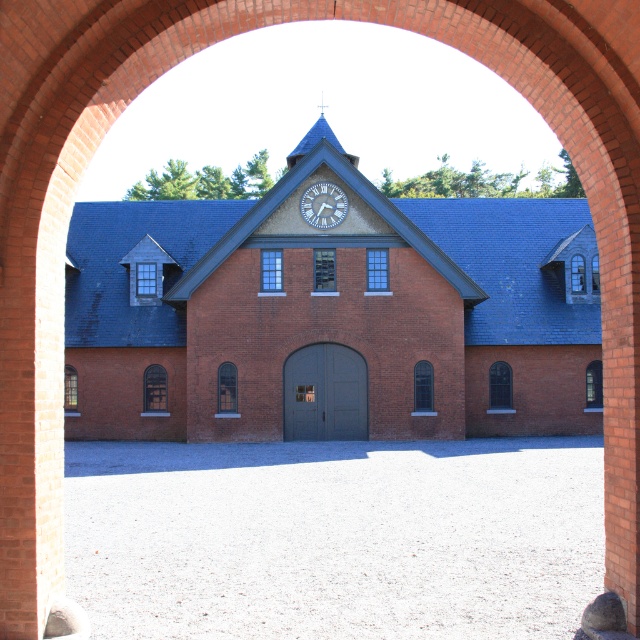
You are standing outside the arched opening and want to hang a decorative banner between the brick building at center and the white textured clock at upper center. Which object should you start measuring from to ensure the banner is centered between them?

You should start measuring from the white textured clock at upper center because the brick building at center is to its right, so the center point between them would be closer to the clock.

You are standing in front of an arched opening that frames a view of a brick building. Based on the coordinates provided, can you determine the position of the brick building at center within the scene?

The brick building at center is located at the coordinates point [332,314].